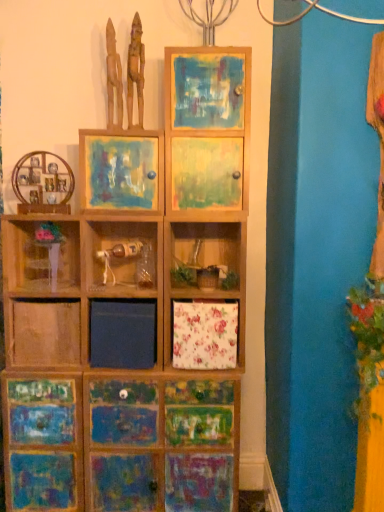
At what (x,y) coordinates should I click in order to perform the action: click on wooden painted drawer at center, the second cabinetry from the top. Please return your answer as a coordinate pair (x, y). The image size is (384, 512). Looking at the image, I should click on (121, 444).

What do you see at coordinates (135, 71) in the screenshot? This screenshot has height=512, width=384. I see `wooden figure at upper left, positioned as the 2th sculpture in left-to-right order` at bounding box center [135, 71].

The width and height of the screenshot is (384, 512). Describe the element at coordinates (113, 78) in the screenshot. I see `wooden figurines at upper center, which is counted as the 1th sculpture, starting from the left` at that location.

The width and height of the screenshot is (384, 512). What do you see at coordinates (40, 254) in the screenshot?
I see `translucent plastic vase at lower left` at bounding box center [40, 254].

Where is `wooden shelf at left, the 1th cabinetry from the top`? The image size is (384, 512). wooden shelf at left, the 1th cabinetry from the top is located at coordinates (42, 184).

In order to click on wooden painted cabinet at lower left, arranged as the first cabinetry when ordered from the bottom in this screenshot , I will do `click(42, 444)`.

Identify the location of painted wood picture frame at upper center. (121, 170).

What's the angular difference between painted wood picture frame at upper center and painted wood cabinet at upper center's facing directions?

The facing directions of painted wood picture frame at upper center and painted wood cabinet at upper center are 1.05 degrees apart.

Is painted wood picture frame at upper center touching painted wood cabinet at upper center?

No, painted wood picture frame at upper center is not touching painted wood cabinet at upper center.

In the scene shown: Could you tell me if painted wood picture frame at upper center is turned towards painted wood cabinet at upper center?

No, painted wood picture frame at upper center does not turn towards painted wood cabinet at upper center.

Can you confirm if painted wood picture frame at upper center is thinner than painted wood cabinet at upper center?

Yes.

Is wooden shelf at left, the 1th cabinetry from the top, placed right next to painted wood picture frame at upper center?

No, wooden shelf at left, the 1th cabinetry from the top, is not touching painted wood picture frame at upper center.

Is wooden shelf at left, the 1th cabinetry from the top, bigger than painted wood picture frame at upper center?

No.

In the scene shown: Is translucent plastic vase at lower left with painted wood picture frame at upper center?

No.

Is painted wood picture frame at upper center a part of translucent plastic vase at lower left?

No, translucent plastic vase at lower left does not contain painted wood picture frame at upper center.

Image resolution: width=384 pixels, height=512 pixels. In order to click on shelf behind the painted wood picture frame at upper center in this screenshot , I will do 40,254.

In the image, is translucent plastic vase at lower left on the left side or the right side of painted wood picture frame at upper center?

In the image, translucent plastic vase at lower left appears on the left side of painted wood picture frame at upper center.

Is painted wood cabinet at upper center smaller than wooden figurines at upper center, acting as the 2th sculpture starting from the right?

Incorrect, painted wood cabinet at upper center is not smaller in size than wooden figurines at upper center, acting as the 2th sculpture starting from the right.

Is painted wood cabinet at upper center not within wooden figurines at upper center, acting as the 2th sculpture starting from the right?

That's correct, painted wood cabinet at upper center is outside of wooden figurines at upper center, acting as the 2th sculpture starting from the right.

Which object is thinner, painted wood cabinet at upper center or wooden figurines at upper center, acting as the 2th sculpture starting from the right?

Thinner between the two is wooden figurines at upper center, acting as the 2th sculpture starting from the right.

From the image's perspective, is painted wood cabinet at upper center beneath wooden figurines at upper center, which is counted as the 1th sculpture, starting from the left?

Indeed, from the image's perspective, painted wood cabinet at upper center is shown beneath wooden figurines at upper center, which is counted as the 1th sculpture, starting from the left.

Does wooden shelf at left, the 1th cabinetry from the top, have a greater width compared to painted wood cabinet at upper center?

Incorrect, the width of wooden shelf at left, the 1th cabinetry from the top, does not surpass that of painted wood cabinet at upper center.

Considering the positions of objects wooden shelf at left, the 1th cabinetry from the top, and painted wood cabinet at upper center in the image provided, who is in front, wooden shelf at left, the 1th cabinetry from the top, or painted wood cabinet at upper center?

painted wood cabinet at upper center is in front.

From the image's perspective, is wooden shelf at left, the 1th cabinetry from the top, above painted wood cabinet at upper center?

No, from the image's perspective, wooden shelf at left, the 1th cabinetry from the top, is not on top of painted wood cabinet at upper center.

From a real-world perspective, which is physically above, wooden shelf at left, marked as the 3th cabinetry in a bottom-to-top arrangement, or painted wood cabinet at upper center?

From a 3D spatial view, painted wood cabinet at upper center is above.

Is wooden shelf at left, the 1th cabinetry from the top, positioned far away from wooden figurines at upper center, acting as the 2th sculpture starting from the right?

No, there isn't a large distance between wooden shelf at left, the 1th cabinetry from the top, and wooden figurines at upper center, acting as the 2th sculpture starting from the right.

From the picture: Does wooden shelf at left, the 1th cabinetry from the top, have a lesser height compared to wooden figurines at upper center, acting as the 2th sculpture starting from the right?

Yes.

From a real-world perspective, is wooden shelf at left, marked as the 3th cabinetry in a bottom-to-top arrangement, beneath wooden figurines at upper center, which is counted as the 1th sculpture, starting from the left?

Yes.

How distant is wooden figurines at upper center, which is counted as the 1th sculpture, starting from the left, from wooden painted drawer at center, the second cabinetry from the top?

wooden figurines at upper center, which is counted as the 1th sculpture, starting from the left, and wooden painted drawer at center, the second cabinetry from the top, are 5.62 feet apart from each other.

Based on their positions, is wooden figurines at upper center, acting as the 2th sculpture starting from the right, located to the left or right of wooden painted drawer at center, the 2th cabinetry positioned from the bottom?

Clearly, wooden figurines at upper center, acting as the 2th sculpture starting from the right, is on the left of wooden painted drawer at center, the 2th cabinetry positioned from the bottom, in the image.

Is point (118, 79) farther from camera compared to point (25, 470)?

Yes, point (118, 79) is behind point (25, 470).

Is wooden figurines at upper center, which is counted as the 1th sculpture, starting from the left, in contact with wooden painted drawer at center, the second cabinetry from the top?

No.

Locate an element on the screen. The image size is (384, 512). cabinet that is above the painted wood picture frame at upper center (from a real-world perspective) is located at coordinates (207, 127).

Locate an element on the screen. The width and height of the screenshot is (384, 512). the 1st cabinetry behind the painted wood picture frame at upper center is located at coordinates (42, 184).

From the image, which object appears to be nearer to translucent plastic vase at lower left, wooden shelf at left, the 1th cabinetry from the top, or painted wood cabinet at upper center?

The object closer to translucent plastic vase at lower left is wooden shelf at left, the 1th cabinetry from the top.

Based on their spatial positions, is wooden painted drawer at center, the 2th cabinetry positioned from the bottom, or wooden figurines at upper center, which is counted as the 1th sculpture, starting from the left, further from wooden figure at upper left, positioned as the 2th sculpture in left-to-right order?

wooden painted drawer at center, the 2th cabinetry positioned from the bottom, is positioned further to the anchor wooden figure at upper left, positioned as the 2th sculpture in left-to-right order.

Estimate the real-world distances between objects in this image. Which object is further from wooden painted cabinet at lower left, which appears as the 3th cabinetry when viewed from the top, wooden figurines at upper center, which is counted as the 1th sculpture, starting from the left, or painted wood picture frame at upper center?

Among the two, wooden figurines at upper center, which is counted as the 1th sculpture, starting from the left, is located further to wooden painted cabinet at lower left, which appears as the 3th cabinetry when viewed from the top.

Which object lies nearer to the anchor point wooden shelf at left, marked as the 3th cabinetry in a bottom-to-top arrangement, painted wood cabinet at upper center or translucent plastic vase at lower left?

translucent plastic vase at lower left.

Estimate the real-world distances between objects in this image. Which object is closer to wooden figurines at upper center, which is counted as the 1th sculpture, starting from the left, painted wood cabinet at upper center or translucent plastic vase at lower left?

painted wood cabinet at upper center.

Estimate the real-world distances between objects in this image. Which object is closer to wooden figure at upper left, positioned as the 2th sculpture in left-to-right order, wooden painted cabinet at lower left, which appears as the 3th cabinetry when viewed from the top, or painted wood picture frame at upper center?

painted wood picture frame at upper center is closer to wooden figure at upper left, positioned as the 2th sculpture in left-to-right order.

Considering their positions, is painted wood picture frame at upper center positioned closer to wooden figurines at upper center, acting as the 2th sculpture starting from the right, than wooden shelf at left, the 1th cabinetry from the top?

painted wood picture frame at upper center lies closer to wooden figurines at upper center, acting as the 2th sculpture starting from the right, than the other object.

From the image, which object appears to be nearer to painted wood picture frame at upper center, wooden shelf at left, marked as the 3th cabinetry in a bottom-to-top arrangement, or translucent plastic vase at lower left?

wooden shelf at left, marked as the 3th cabinetry in a bottom-to-top arrangement, lies closer to painted wood picture frame at upper center than the other object.

The width and height of the screenshot is (384, 512). I want to click on shelf between wooden figurines at upper center, acting as the 2th sculpture starting from the right, and wooden painted cabinet at lower left, arranged as the first cabinetry when ordered from the bottom, vertically, so click(x=40, y=254).

Where is `cabinet between wooden figure at upper left, the first sculpture in the right-to-left sequence, and wooden painted drawer at center, the second cabinetry from the top, in the vertical direction`? cabinet between wooden figure at upper left, the first sculpture in the right-to-left sequence, and wooden painted drawer at center, the second cabinetry from the top, in the vertical direction is located at coordinates (207, 127).

In order to click on cabinet between wooden figurines at upper center, which is counted as the 1th sculpture, starting from the left, and translucent plastic vase at lower left vertically in this screenshot , I will do `click(207, 127)`.

Where is `picture frame between wooden figurines at upper center, acting as the 2th sculpture starting from the right, and translucent plastic vase at lower left from top to bottom`? The height and width of the screenshot is (512, 384). picture frame between wooden figurines at upper center, acting as the 2th sculpture starting from the right, and translucent plastic vase at lower left from top to bottom is located at coordinates (121, 170).